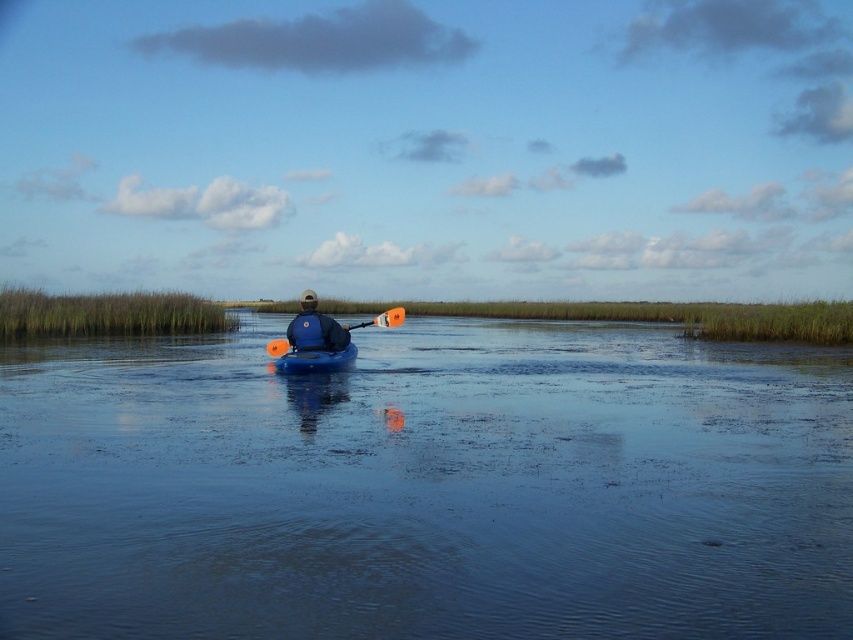
Based on the photo, you are a photographer trying to capture both the blue matte kayak at center and the blue plastic canoe at center in the same frame. Which object should you position closer to the left side of your camera viewfinder to ensure both are visible?

To ensure both the blue matte kayak at center and the blue plastic canoe at center are visible, position the blue matte kayak at center closer to the left side of the camera viewfinder since it is already on the left side of the blue plastic canoe at center.

You are a photographer positioned on the shore observing the blue plastic canoe at center and the orange paddle at center. Which object is closer to the water surface?

The blue plastic canoe at center is located below the orange paddle at center, so the blue plastic canoe at center is closer to the water surface.

You are standing on the shore of the lake and see two points in the water. The first point is at coordinates point (807,588) and the second is at point (328,358). Which point is closer to you?

Point (807,588) is closer to the viewer than point (328,358).